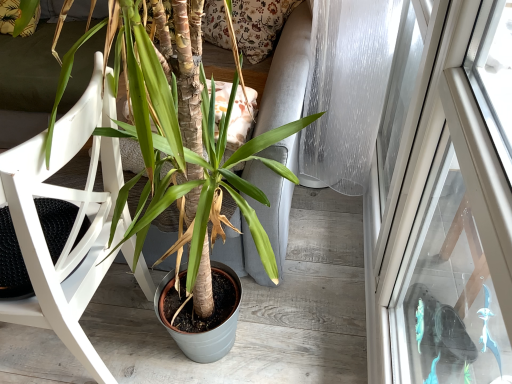
Question: From a real-world perspective, is white wood chair at left positioned above or below matte brown pot at center?

Choices:
 (A) below
 (B) above

Answer: (A)

Question: From the image's perspective, is white wood chair at left positioned above or below matte brown pot at center?

Choices:
 (A) below
 (B) above

Answer: (A)

Question: Is point [x=132, y=238] closer or farther from the camera than point [x=71, y=342]?

Choices:
 (A) farther
 (B) closer

Answer: (A)

Question: In terms of height, does matte brown pot at center look taller or shorter compared to white wood chair at left?

Choices:
 (A) tall
 (B) short

Answer: (A)

Question: Is point (82, 119) positioned closer to the camera than point (56, 284)?

Choices:
 (A) closer
 (B) farther

Answer: (A)

Question: Looking at the image, does matte brown pot at center seem bigger or smaller compared to white wood chair at left?

Choices:
 (A) small
 (B) big

Answer: (B)

Question: From the image's perspective, is matte brown pot at center above or below white wood chair at left?

Choices:
 (A) above
 (B) below

Answer: (A)